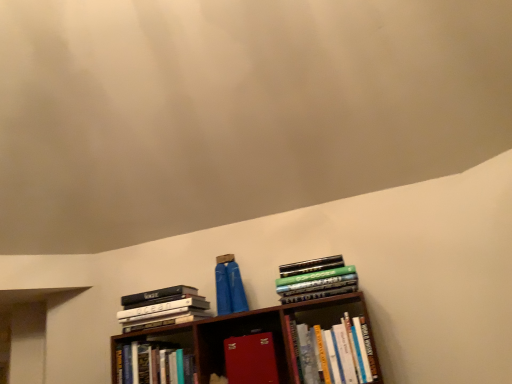
Question: From a real-world perspective, is matte red suitcase at center, the 3th book positioned from the right, physically located above or below hardcover books at upper right, the second book when ordered from right to left?

Choices:
 (A) below
 (B) above

Answer: (A)

Question: Is point (230, 340) closer or farther from the camera than point (300, 276)?

Choices:
 (A) farther
 (B) closer

Answer: (A)

Question: Considering the real-world distances, which object is farthest from the hardcover book at lower left, positioned as the 4th book in right-to-left order?

Choices:
 (A) matte red suitcase at center, the 3th book positioned from the right
 (B) hardcover books at center, the 5th book in the left-to-right sequence
 (C) hardcover books at left, placed as the 1th book when sorted from left to right
 (D) hardcover books at upper right, the second book when ordered from right to left

Answer: (B)

Question: Which object is the farthest from the matte red suitcase at center, the 3th book positioned from the right?

Choices:
 (A) hardcover books at left, placed as the 1th book when sorted from left to right
 (B) hardcover books at upper right, acting as the 4th book starting from the left
 (C) hardcover book at lower left, the 2th book in the left-to-right sequence
 (D) hardcover books at center, the 5th book in the left-to-right sequence

Answer: (A)